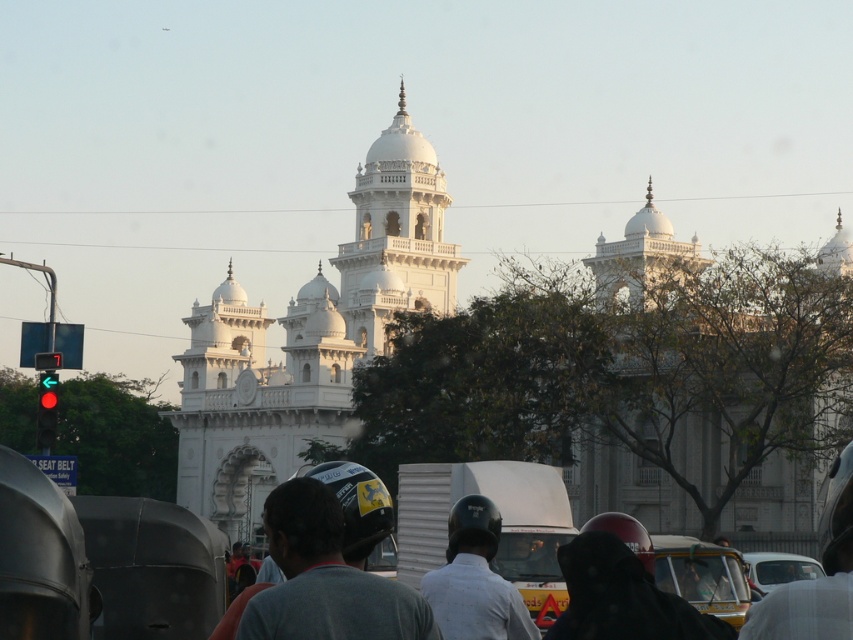
You are a pedestrian standing at the crosswalk near the white marble tower at center and the dark gray helmet at center. Which object is closer to you?

The white marble tower at center is closer to you because the dark gray helmet at center is behind it.

You are standing at the intersection and want to take a photo of the white marble tower at center. According to the coordinates provided, where should you position your camera to capture the tower in the frame?

To capture the white marble tower at center, position your camera at the coordinates point [396,236] as specified.

You are a pedestrian standing at the crosswalk near the white helmet at center and the yellow matte taxi at lower right. You want to cross the street to the other side. Which direction should you look first to check for oncoming traffic?

You should look to the left first because the white helmet at center is positioned on the right side of the yellow matte taxi at lower right, indicating that traffic is moving from left to right in this area.